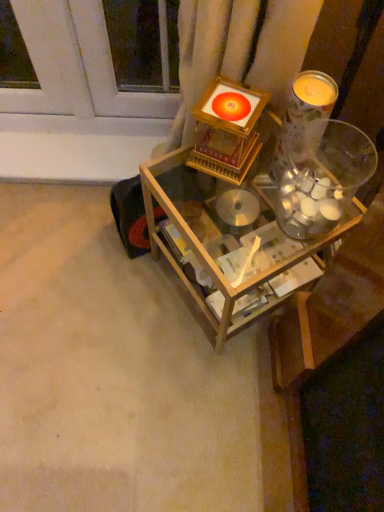
Question: From a real-world perspective, is translucent glass candle at upper right under clear glass jar at upper right?

Choices:
 (A) no
 (B) yes

Answer: (A)

Question: Considering the relative sizes of translucent glass candle at upper right and clear glass jar at upper right in the image provided, is translucent glass candle at upper right bigger than clear glass jar at upper right?

Choices:
 (A) yes
 (B) no

Answer: (B)

Question: Does translucent glass candle at upper right have a lesser width compared to clear glass jar at upper right?

Choices:
 (A) yes
 (B) no

Answer: (A)

Question: Is translucent glass candle at upper right taller than clear glass jar at upper right?

Choices:
 (A) no
 (B) yes

Answer: (B)

Question: Is translucent glass candle at upper right surrounding clear glass jar at upper right?

Choices:
 (A) no
 (B) yes

Answer: (A)

Question: Considering the relative positions of clear glass jar at upper right and translucent glass candle at upper right in the image provided, is clear glass jar at upper right to the left or to the right of translucent glass candle at upper right?

Choices:
 (A) left
 (B) right

Answer: (B)

Question: Is clear glass jar at upper right bigger or smaller than translucent glass candle at upper right?

Choices:
 (A) big
 (B) small

Answer: (A)

Question: From the image's perspective, relative to translucent glass candle at upper right, is clear glass jar at upper right above or below?

Choices:
 (A) above
 (B) below

Answer: (B)

Question: Is clear glass jar at upper right inside the boundaries of translucent glass candle at upper right, or outside?

Choices:
 (A) outside
 (B) inside

Answer: (A)

Question: In the image, is clear glass jar at upper right positioned in front of or behind wooden table at center?

Choices:
 (A) behind
 (B) front

Answer: (B)

Question: Is clear glass jar at upper right bigger or smaller than wooden table at center?

Choices:
 (A) big
 (B) small

Answer: (B)

Question: From a real-world perspective, relative to wooden table at center, is clear glass jar at upper right vertically above or below?

Choices:
 (A) above
 (B) below

Answer: (A)

Question: Considering the positions of clear glass jar at upper right and wooden table at center in the image, is clear glass jar at upper right wider or thinner than wooden table at center?

Choices:
 (A) wide
 (B) thin

Answer: (B)

Question: Considering the positions of wooden table at center and translucent glass candle at upper right in the image, is wooden table at center bigger or smaller than translucent glass candle at upper right?

Choices:
 (A) big
 (B) small

Answer: (A)

Question: Is wooden table at center inside or outside of translucent glass candle at upper right?

Choices:
 (A) outside
 (B) inside

Answer: (A)